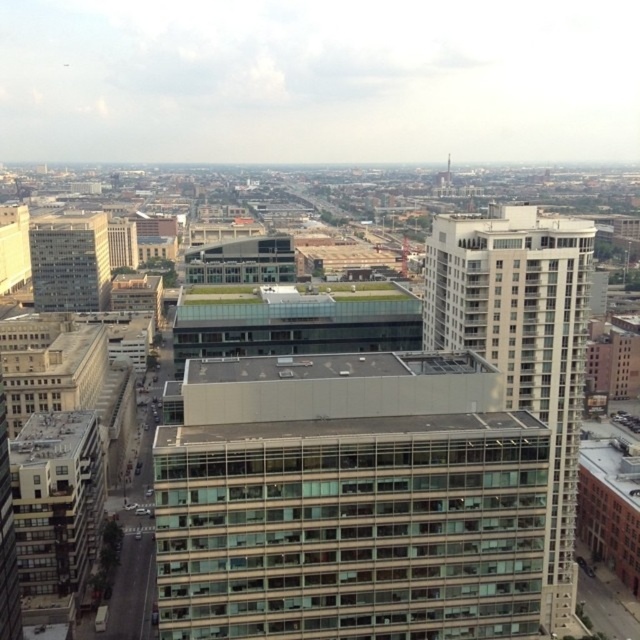
You are an architect designing a new skyscraper and want to ensure it doesn not block sunlight to the white glass building at center. Considering the light gray concrete building at left is wider, which building should your new skyscraper be placed farther away from?

The new skyscraper should be placed farther away from the white glass building at center because it has a smaller width than the light gray concrete building at left, making it more vulnerable to sunlight obstruction.

You are standing on the rooftop of the light gray concrete building at left. Looking out, you see the white glass building at center. In which direction should you look to see it?

The white glass building at center is to the right of the light gray concrete building at left, so you should look to your right to see it.

You are an architect analyzing the urban layout. Based on the scene, which of the two buildings, the white glass building at center or the light gray concrete building at left, has a larger footprint in terms of floor area?

The light gray concrete building at left has a larger footprint in terms of floor area because it is larger than the white glass building at center.